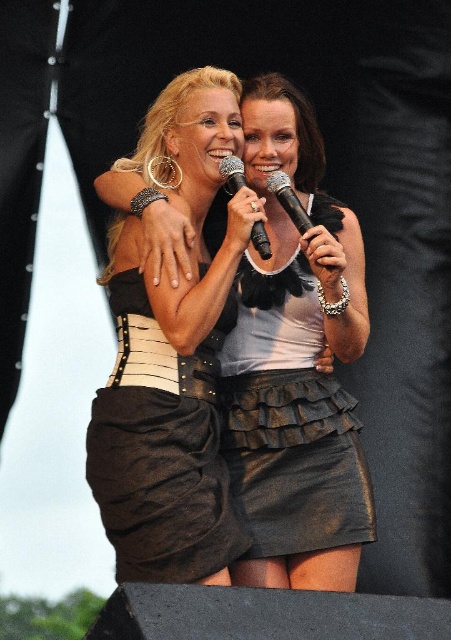
Is matte black dress at center to the right of black plastic microphone at center from the viewer's perspective?

Indeed, matte black dress at center is positioned on the right side of black plastic microphone at center.

Does point (308, 291) come in front of point (298, 200)?

No.

The height and width of the screenshot is (640, 451). I want to click on matte black dress at center, so click(x=295, y=365).

Between black leather skirt at center and black plastic microphone at center, which one is positioned lower?

black leather skirt at center is lower down.

Between black leather skirt at center and black plastic microphone at center, which one is positioned higher?

black plastic microphone at center

Who is more distant from viewer, [203,353] or [298,220]?

The point [203,353] is more distant.

You are a GUI agent. You are given a task and a screenshot of the screen. Output one action in this format:
    pyautogui.click(x=<x>, y=<y>)
    Task: Click on the black leather skirt at center
    The height and width of the screenshot is (640, 451).
    Given the screenshot: What is the action you would take?
    pyautogui.click(x=161, y=449)

Is denim skirt at center further to the viewer compared to black metallic microphone at center?

No, denim skirt at center is closer to the viewer.

Does denim skirt at center appear on the right side of black metallic microphone at center?

Indeed, denim skirt at center is positioned on the right side of black metallic microphone at center.

Locate an element on the screen. The image size is (451, 640). denim skirt at center is located at coordinates (289, 422).

At what (x,y) coordinates should I click in order to perform the action: click on denim skirt at center. Please return your answer as a coordinate pair (x, y). The image size is (451, 640). Looking at the image, I should click on (289, 422).